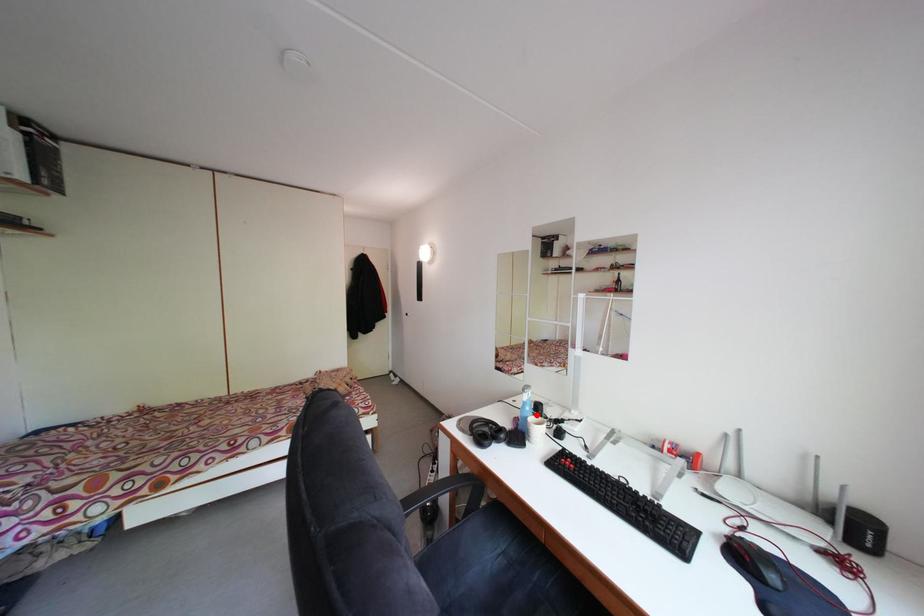
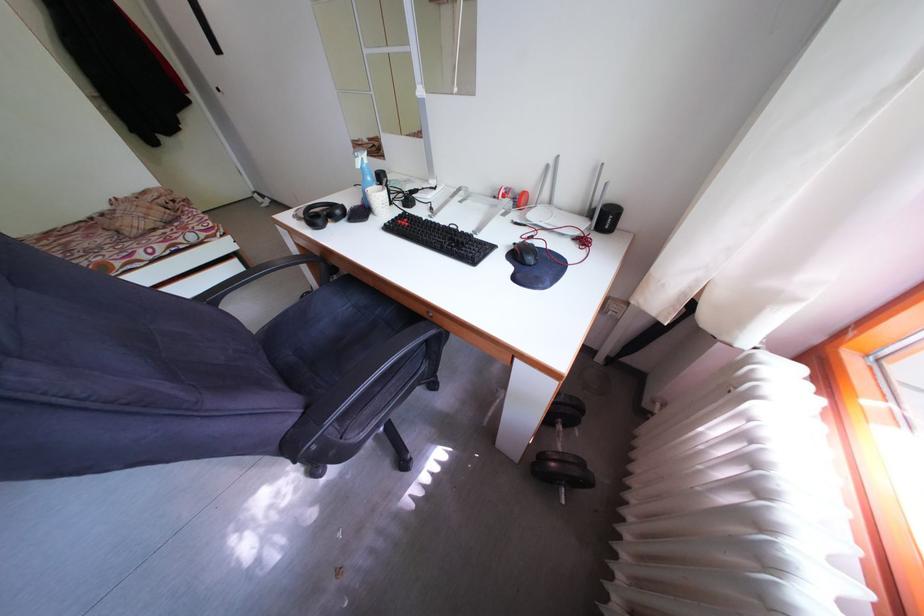
Find the pixel in the second image that matches the highlighted location in the first image.

(378, 185)